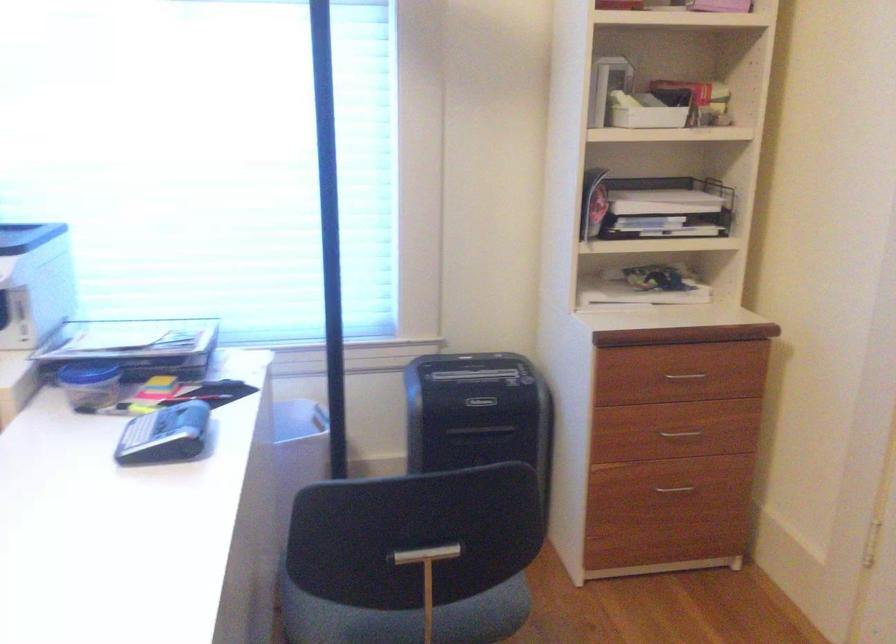
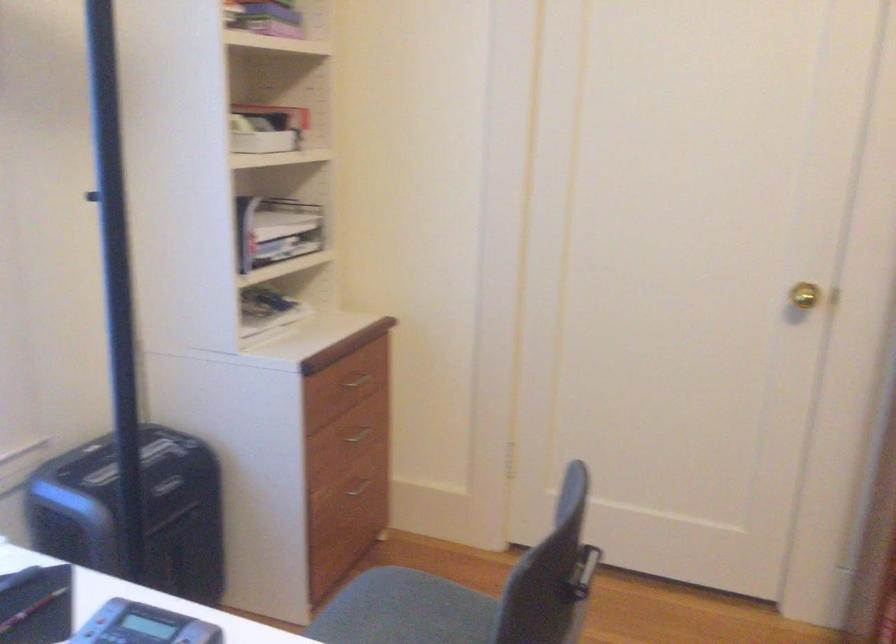
Locate, in the second image, the point that corresponds to point 684,375 in the first image.

(356, 381)